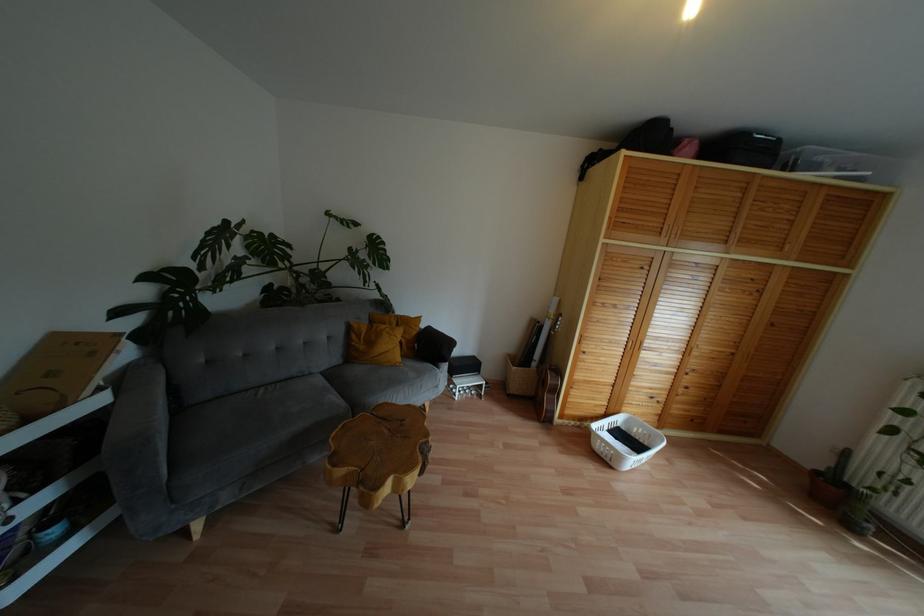
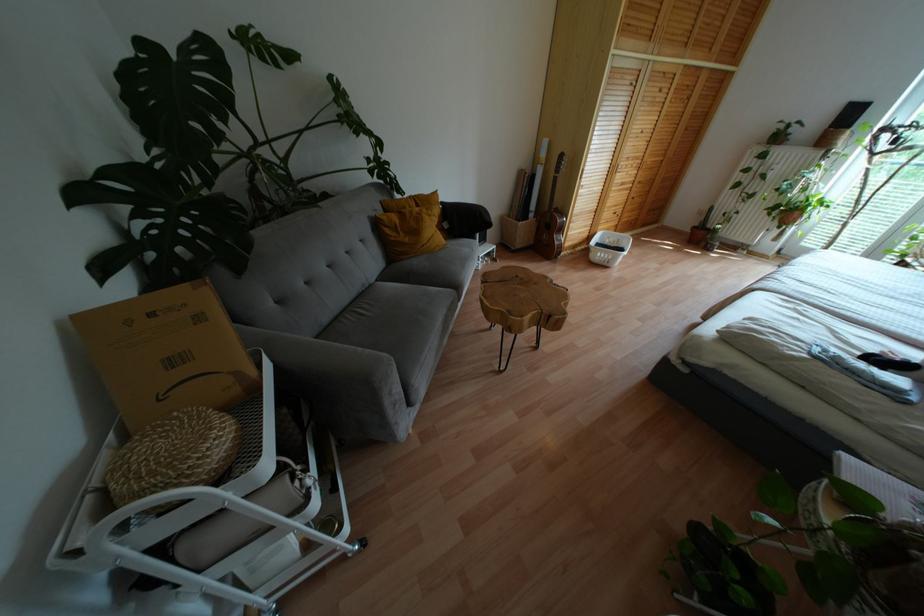
Find the pixel in the second image that matches [554,391] in the first image.

(560, 229)